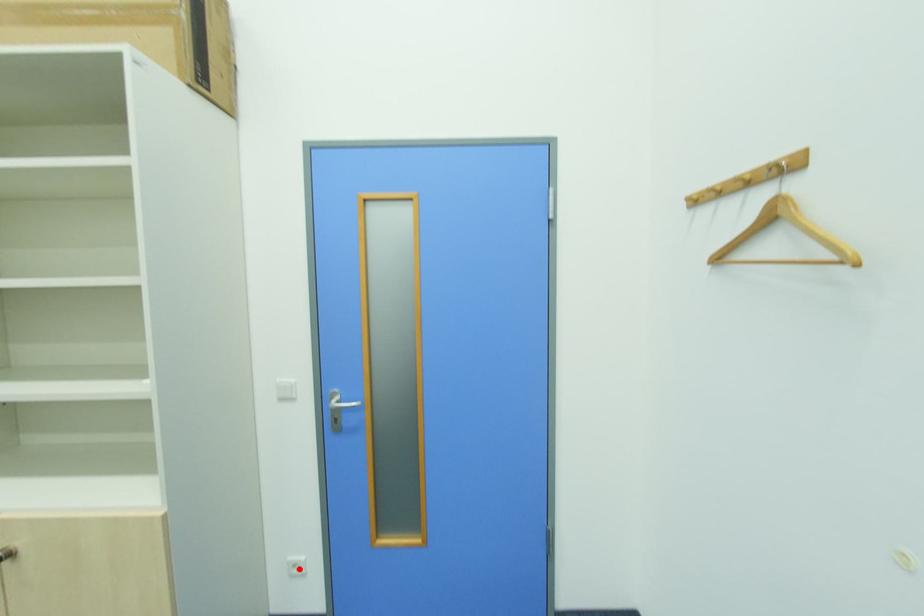
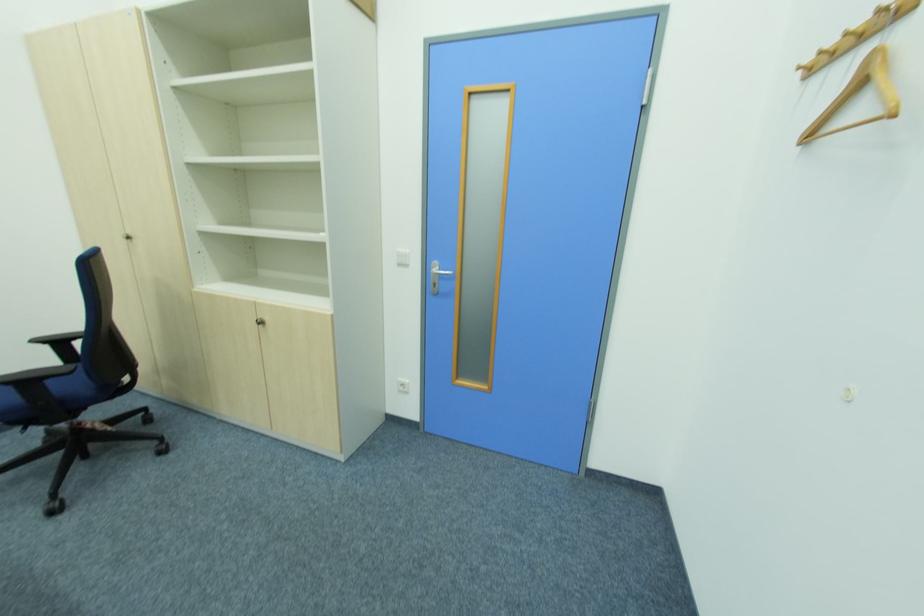
Question: A red point is marked in image1. In image2, is the corresponding 3D point closer to the camera or farther? Reply with the corresponding letter.

Choices:
 (A) The corresponding 3D point is closer.
 (B) The corresponding 3D point is farther.

Answer: (B)